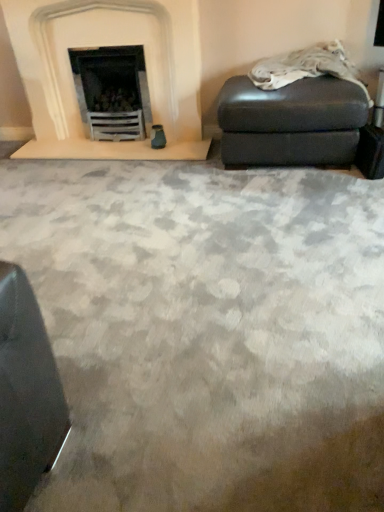
Question: From the image's perspective, is white stone fireplace at upper left located above or below matte gray ottoman at right?

Choices:
 (A) above
 (B) below

Answer: (A)

Question: Is white stone fireplace at upper left wider or thinner than matte gray ottoman at right?

Choices:
 (A) wide
 (B) thin

Answer: (B)

Question: Estimate the real-world distances between objects in this image. Which object is closer to the white stone fireplace at upper left?

Choices:
 (A) matte gray ottoman at right
 (B) leather ottoman at upper right

Answer: (A)

Question: Which of these objects is positioned closest to the white stone fireplace at upper left?

Choices:
 (A) matte gray ottoman at right
 (B) leather ottoman at upper right

Answer: (A)